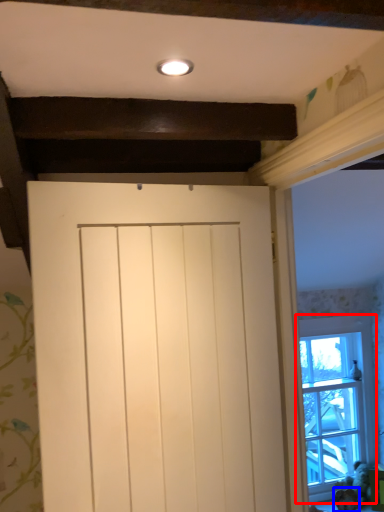
Question: Which object appears farthest to the camera in this image, window (highlighted by a red box) or animal (highlighted by a blue box)?

Choices:
 (A) window
 (B) animal

Answer: (A)